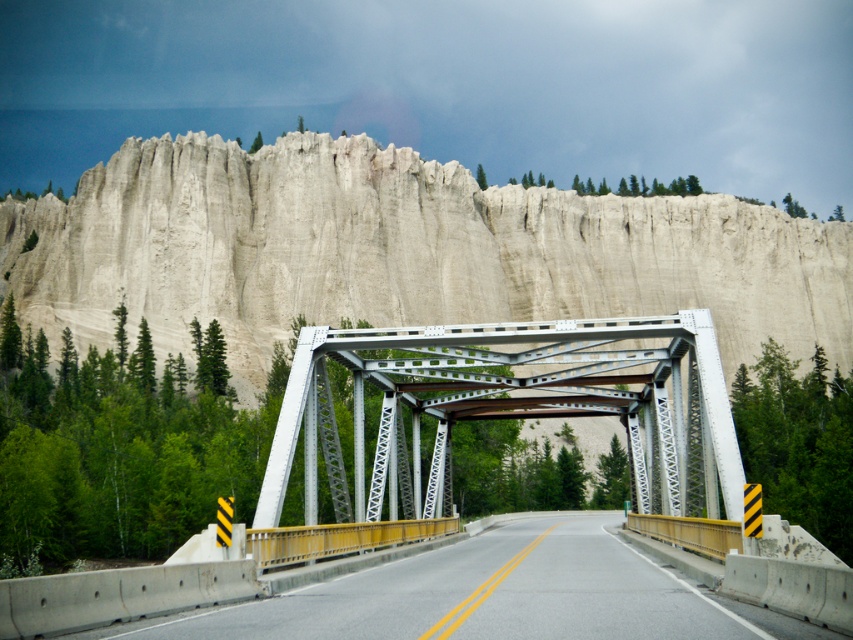
Question: In this image, where is smooth sandstone cliff at upper center located relative to yellow painted concrete highway at center?

Choices:
 (A) left
 (B) right

Answer: (B)

Question: Where is smooth sandstone cliff at upper center located in relation to yellow painted concrete highway at center in the image?

Choices:
 (A) above
 (B) below

Answer: (A)

Question: Which object is farther from the camera taking this photo?

Choices:
 (A) smooth sandstone cliff at upper center
 (B) yellow painted concrete highway at center
 (C) white metallic bridge at center

Answer: (A)

Question: Is white metallic bridge at center smaller than yellow painted concrete highway at center?

Choices:
 (A) no
 (B) yes

Answer: (A)

Question: Considering the real-world distances, which object is farthest from the yellow painted concrete highway at center?

Choices:
 (A) smooth sandstone cliff at upper center
 (B) white metallic bridge at center

Answer: (A)

Question: Estimate the real-world distances between objects in this image. Which object is closer to the white metallic bridge at center?

Choices:
 (A) yellow painted concrete highway at center
 (B) smooth sandstone cliff at upper center

Answer: (A)